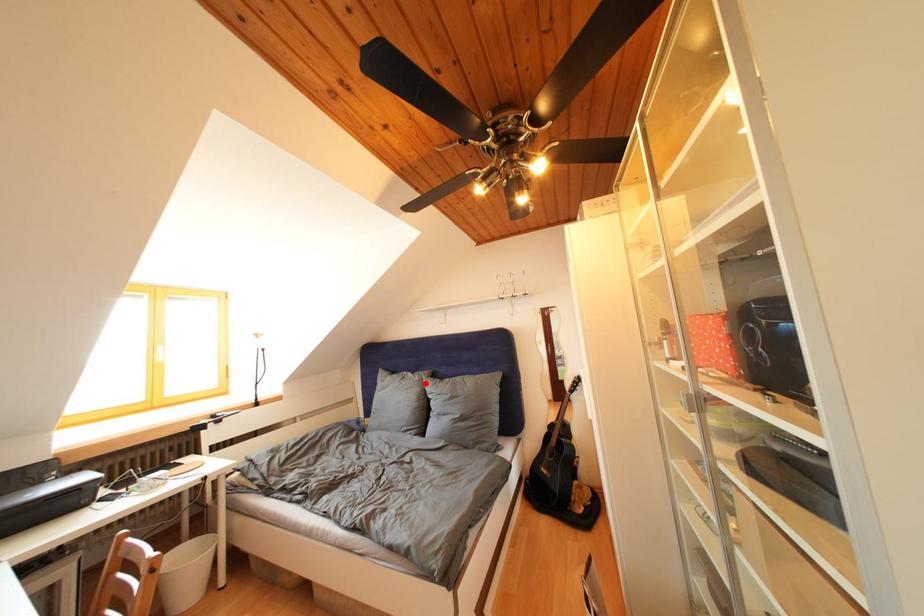
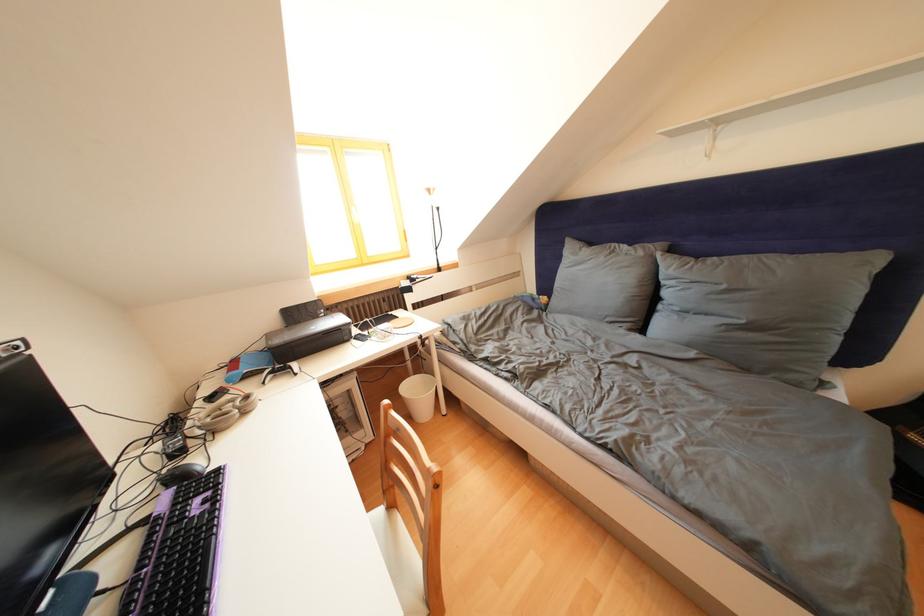
In the second image, find the point that corresponds to the highlighted location in the first image.

(649, 259)